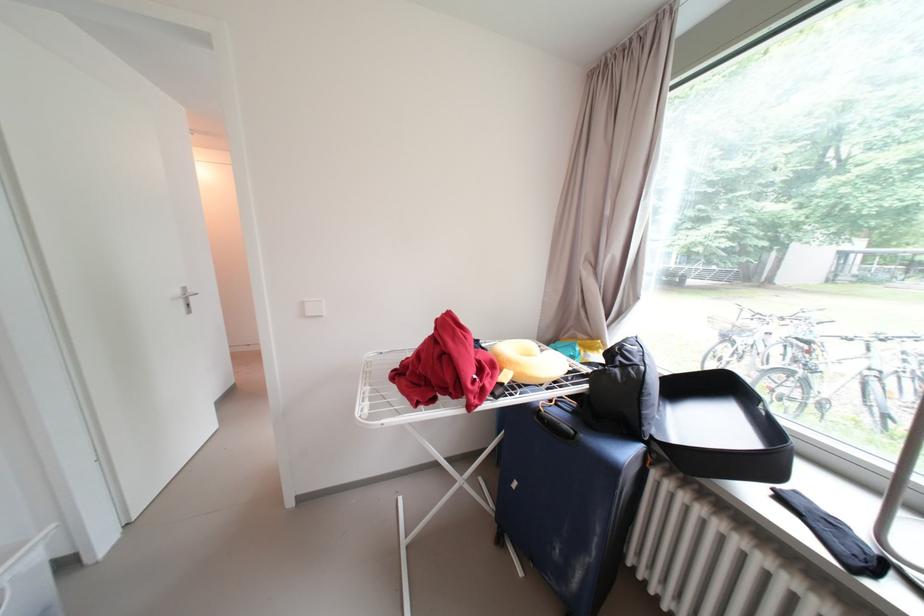
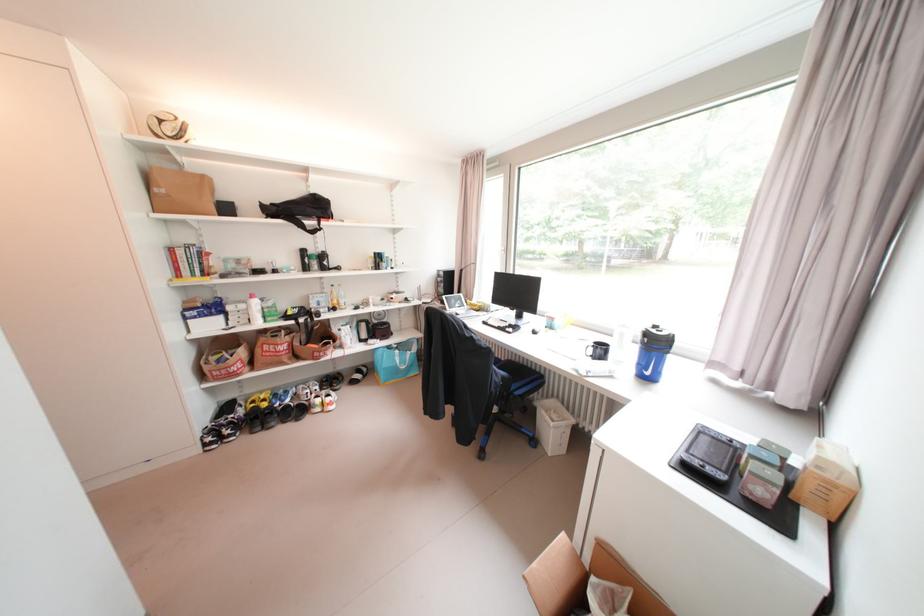
The images are taken continuously from a first-person perspective. In which direction are you moving?

The movement direction of the cameraman is left, forward.